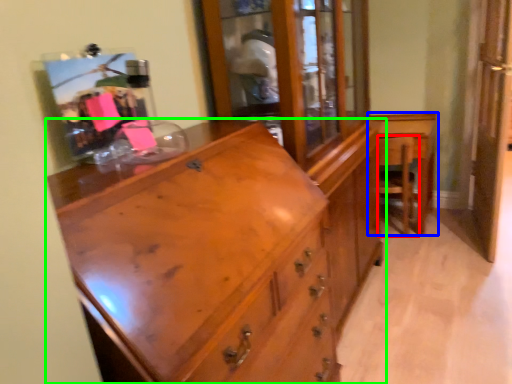
Question: Which object is positioned closest to armchair (highlighted by a red box)? Select from table (highlighted by a blue box) and chest of drawers (highlighted by a green box).

Choices:
 (A) table
 (B) chest of drawers

Answer: (A)